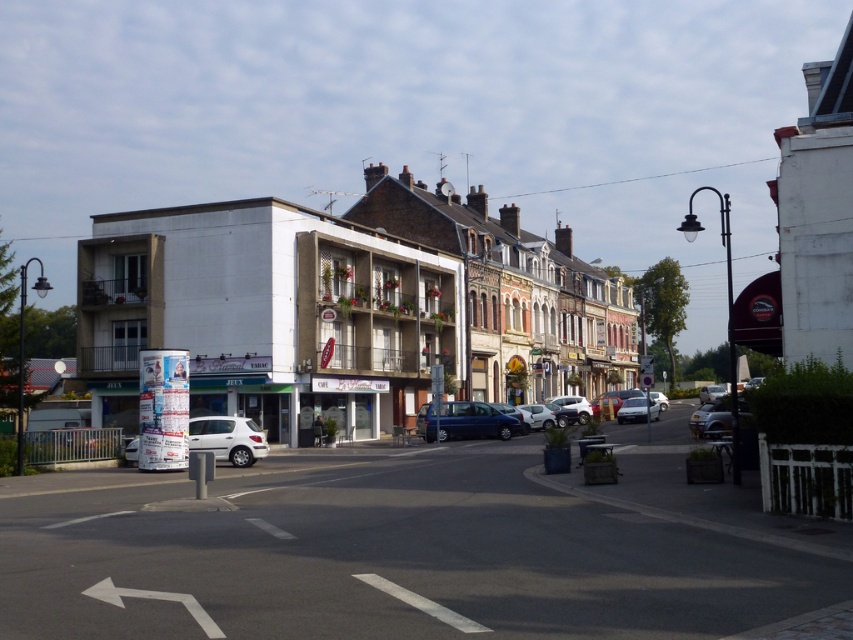
Can you confirm if white concrete building at center is wider than silver metallic sedan at center-right?

Yes, white concrete building at center is wider than silver metallic sedan at center-right.

The image size is (853, 640). Find the location of `white concrete building at center`. white concrete building at center is located at coordinates (344, 308).

Does point (241, 429) come farther from viewer compared to point (630, 412)?

No.

Does point (126, 451) come in front of point (648, 408)?

Yes.

Is point (241, 467) less distant than point (643, 404)?

Yes.

Locate an element on the screen. This screenshot has width=853, height=640. white matte car at lower left is located at coordinates (228, 438).

Can you confirm if white matte car at center is positioned to the left of silver metallic sedan at center-right?

A: Correct, you'll find white matte car at center to the left of silver metallic sedan at center-right.

From the picture: Who is more distant from viewer, (384,492) or (643,404)?

Point (643,404)

Where is `white matte car at center`? The height and width of the screenshot is (640, 853). white matte car at center is located at coordinates (415, 550).